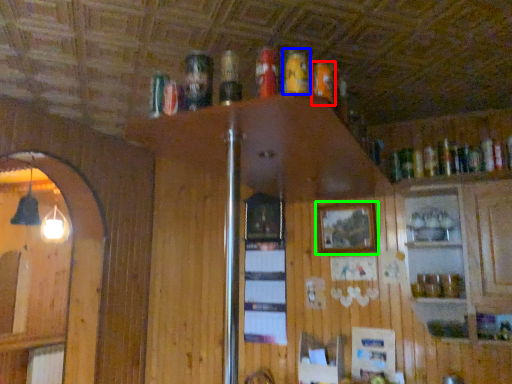
Question: Which object is the closest to the beer (highlighted by a red box)? Choose among these: beer (highlighted by a blue box) or picture frame (highlighted by a green box).

Choices:
 (A) beer
 (B) picture frame

Answer: (A)